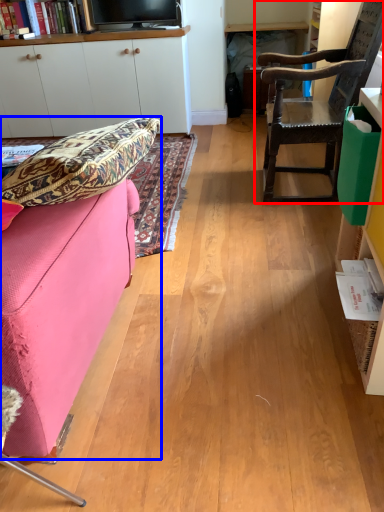
Question: Which of the following is the closest to the observer, chair (highlighted by a red box) or studio couch (highlighted by a blue box)?

Choices:
 (A) chair
 (B) studio couch

Answer: (B)